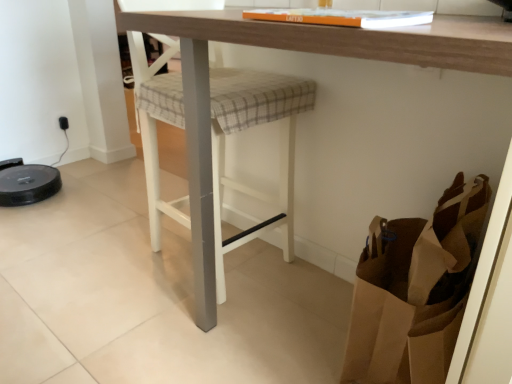
Locate an element on the screen. This screenshot has width=512, height=384. free spot in front of plaid fabric step stool at center is located at coordinates [x=133, y=335].